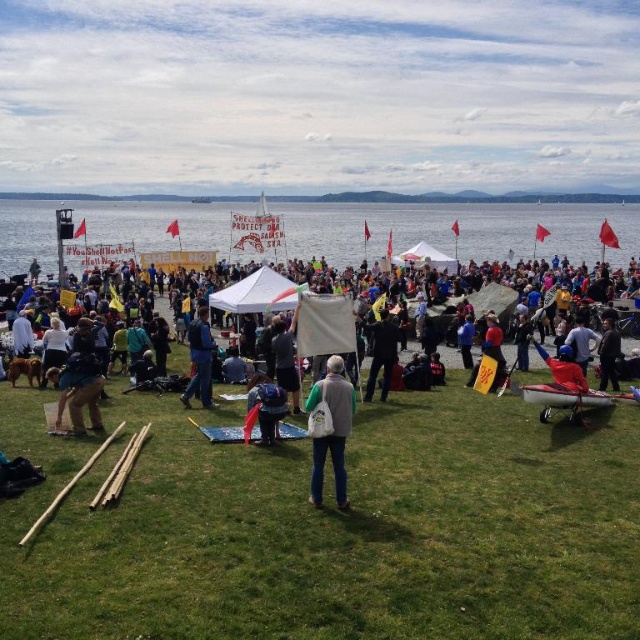
Based on the photo, is green grass at center positioned in front of gray fabric vest at center?

Yes, green grass at center is in front of gray fabric vest at center.

From the picture: Who is higher up, green grass at center or gray fabric vest at center?

gray fabric vest at center

Locate an element on the screen. green grass at center is located at coordinates (332, 528).

Image resolution: width=640 pixels, height=640 pixels. Identify the location of green grass at center. (332, 528).

Is denim jacket at lower left smaller than dark brown leather jacket at center?

Incorrect, denim jacket at lower left is not smaller in size than dark brown leather jacket at center.

Does point (592, 396) come farther from viewer compared to point (612, 308)?

No, (592, 396) is closer to viewer.

Is point (636, 308) positioned after point (598, 349)?

Yes, point (636, 308) is behind point (598, 349).

What are the coordinates of `denim jacket at lower left` in the screenshot? It's located at (500, 358).

Which is behind, point (250, 403) or point (604, 353)?

The point (604, 353) is more distant.

Which is above, dark blue backpack at center or dark brown leather jacket at center?

dark brown leather jacket at center

Who is more forward, (262, 392) or (609, 365)?

Point (262, 392)

Locate an element on the screen. Image resolution: width=640 pixels, height=640 pixels. dark blue backpack at center is located at coordinates (266, 406).